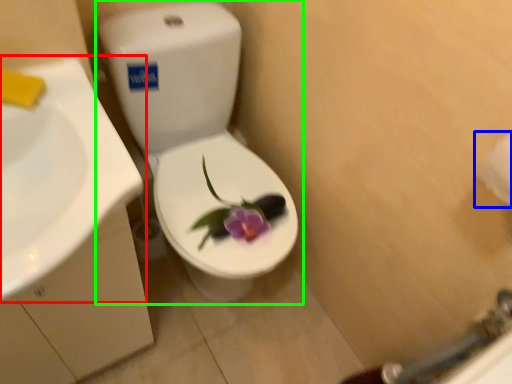
Question: Which object is positioned farthest from sink (highlighted by a red box)? Select from toilet paper (highlighted by a blue box) and toilet (highlighted by a green box).

Choices:
 (A) toilet paper
 (B) toilet

Answer: (A)